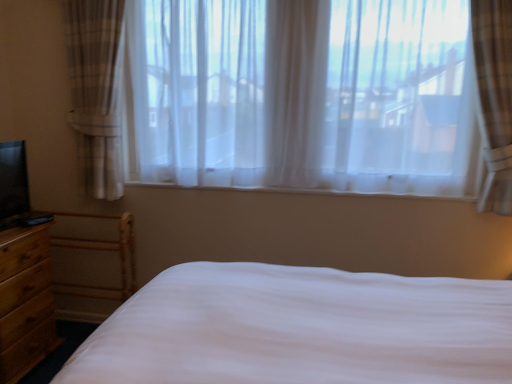
Find the location of a particular element. Image resolution: width=512 pixels, height=384 pixels. brown wood nightstand at lower left is located at coordinates (25, 301).

Consider the image. What is the approximate width of brown wood nightstand at lower left?

brown wood nightstand at lower left is 17.30 inches in width.

Describe the element at coordinates (25, 301) in the screenshot. I see `brown wood nightstand at lower left` at that location.

This screenshot has height=384, width=512. Describe the element at coordinates (296, 94) in the screenshot. I see `sheer white curtains at center` at that location.

Where is `sheer white curtains at center`? sheer white curtains at center is located at coordinates (296, 94).

Where is `brown wood nightstand at lower left`? Image resolution: width=512 pixels, height=384 pixels. brown wood nightstand at lower left is located at coordinates (25, 301).

Which is more to the left, sheer white curtains at center or brown wood nightstand at lower left?

Positioned to the left is brown wood nightstand at lower left.

Which object is further away from the camera, sheer white curtains at center or brown wood nightstand at lower left?

sheer white curtains at center is further from the camera.

Which is nearer, (490, 184) or (42, 335)?

Point (490, 184) is closer to the camera than point (42, 335).

From the image's perspective, is sheer white curtains at center on top of brown wood nightstand at lower left?

Yes, from the image's perspective, sheer white curtains at center is on top of brown wood nightstand at lower left.

From a real-world perspective, which object stands above the other?

From a 3D spatial view, sheer white curtains at center is above.

Considering the sizes of objects sheer white curtains at center and brown wood nightstand at lower left in the image provided, who is thinner, sheer white curtains at center or brown wood nightstand at lower left?

sheer white curtains at center is thinner.

Is sheer white curtains at center taller than brown wood nightstand at lower left?

Indeed, sheer white curtains at center has a greater height compared to brown wood nightstand at lower left.

Based on the photo, who is bigger, sheer white curtains at center or brown wood nightstand at lower left?

sheer white curtains at center.

Is brown wood nightstand at lower left inside sheer white curtains at center?

Actually, brown wood nightstand at lower left is outside sheer white curtains at center.

Are sheer white curtains at center and brown wood nightstand at lower left beside each other?

No, sheer white curtains at center is not next to brown wood nightstand at lower left.

In the scene shown: Is sheer white curtains at center facing away from brown wood nightstand at lower left?

That's not correct — sheer white curtains at center is not looking away from brown wood nightstand at lower left.

How distant is sheer white curtains at center from brown wood nightstand at lower left?

The distance of sheer white curtains at center from brown wood nightstand at lower left is 3.68 feet.

Where is `window above the brown wood nightstand at lower left (from the image's perspective)`? The width and height of the screenshot is (512, 384). window above the brown wood nightstand at lower left (from the image's perspective) is located at coordinates (296, 94).

Considering the positions of objects brown wood nightstand at lower left and sheer white curtains at center in the image provided, who is more to the right, brown wood nightstand at lower left or sheer white curtains at center?

From the viewer's perspective, sheer white curtains at center appears more on the right side.

In the image, is brown wood nightstand at lower left positioned in front of or behind sheer white curtains at center?

Visually, brown wood nightstand at lower left is located in front of sheer white curtains at center.

Is point (16, 341) less distant than point (487, 154)?

Yes, it is in front of point (487, 154).

From the image's perspective, between brown wood nightstand at lower left and sheer white curtains at center, which one is located above?

sheer white curtains at center appears higher in the image.

From a real-world perspective, relative to sheer white curtains at center, is brown wood nightstand at lower left vertically above or below?

From a real-world perspective, brown wood nightstand at lower left is physically below sheer white curtains at center.

Consider the image. Can you confirm if brown wood nightstand at lower left is thinner than sheer white curtains at center?

No.

In terms of height, does brown wood nightstand at lower left look taller or shorter compared to sheer white curtains at center?

brown wood nightstand at lower left is shorter than sheer white curtains at center.

In terms of size, does brown wood nightstand at lower left appear bigger or smaller than sheer white curtains at center?

Considering their sizes, brown wood nightstand at lower left takes up less space than sheer white curtains at center.

Is brown wood nightstand at lower left outside of sheer white curtains at center?

Yes, brown wood nightstand at lower left is outside of sheer white curtains at center.

Can you see brown wood nightstand at lower left touching sheer white curtains at center?

No, brown wood nightstand at lower left is not with sheer white curtains at center.

In the scene shown: Is brown wood nightstand at lower left oriented away from sheer white curtains at center?

That's not correct — brown wood nightstand at lower left is not looking away from sheer white curtains at center.

How many degrees apart are the facing directions of brown wood nightstand at lower left and sheer white curtains at center?

87.4 degrees.

What are the coordinates of `nightstand below the sheer white curtains at center (from a real-world perspective)` in the screenshot? It's located at (25, 301).

I want to click on window above the brown wood nightstand at lower left (from the image's perspective), so click(x=296, y=94).

Find the location of a particular element. The height and width of the screenshot is (384, 512). nightstand below the sheer white curtains at center (from the image's perspective) is located at coordinates (25, 301).